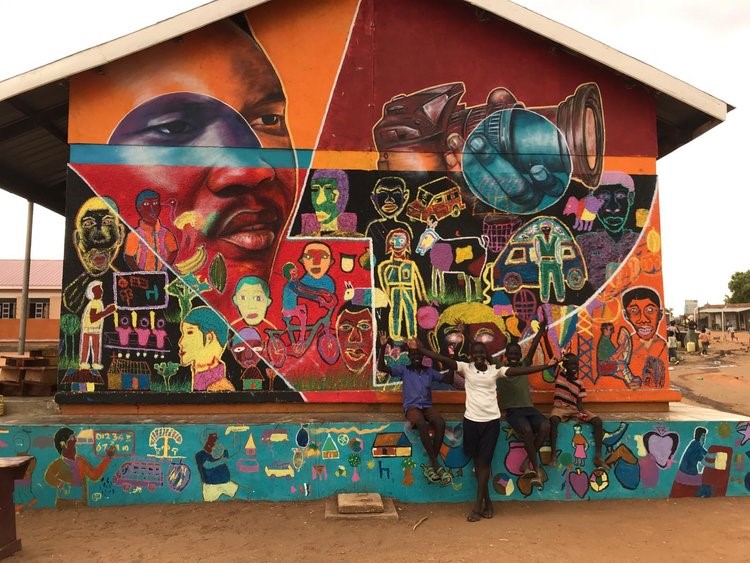
This screenshot has width=750, height=563. Find the location of `tables`. tables is located at coordinates (2, 471), (18, 358).